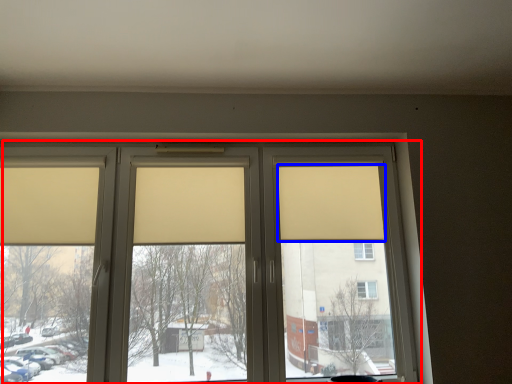
Question: Which object is closer to the camera taking this photo, window (highlighted by a red box) or curtain (highlighted by a blue box)?

Choices:
 (A) window
 (B) curtain

Answer: (A)